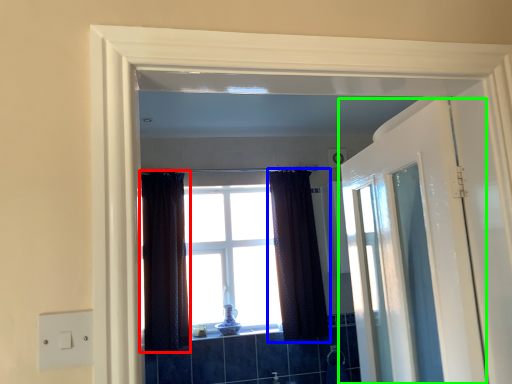
Question: Which object is the farthest from curtain (highlighted by a red box)? Choose among these: curtain (highlighted by a blue box) or door (highlighted by a green box).

Choices:
 (A) curtain
 (B) door

Answer: (B)